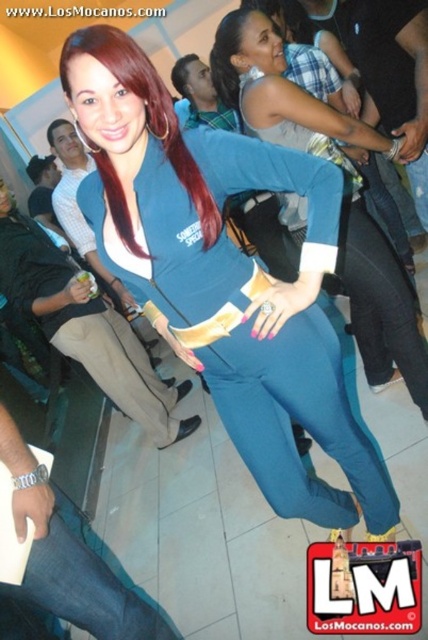
You are a photographer at a party and want to capture a photo of the woman in the center. The blue fabric pants at center and the shiny red hair at center are both in the frame. Which object should you focus on to ensure it appears larger in the photo?

The blue fabric pants at center is much taller than the shiny red hair at center, so focusing on the blue fabric pants at center will make it appear larger in the photo.

You are at a party and want to move from the point at the bottom left corner to the point near the top right corner. Is the path between point (272,67) and point (74,36) clear?

The path between point (272,67) and point (74,36) is clear since point (272,67) is behind point (74,36), meaning there is no obstruction between them.

You are a photographer at the party and want to capture a clear shot of the shiny red hair at center without the dark brown hair at upper center blocking it. What adjustment should you make to your camera angle?

To ensure the shiny red hair at center is visible without the dark brown hair at upper center blocking it, adjust the camera angle downward since the shiny red hair at center is positioned in front of the dark brown hair at upper center.